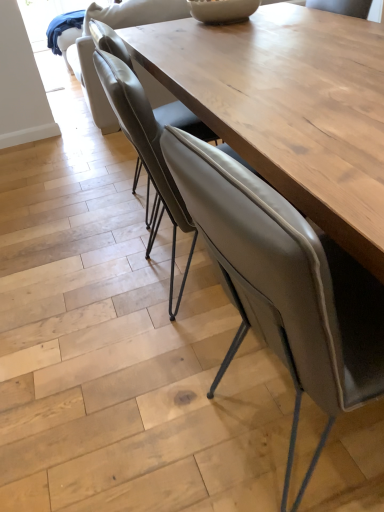
Question: Is matte gray chair at center, the 1th chair when ordered from front to back, taller or shorter than matte gray chair at center, positioned as the second chair in back-to-front order?

Choices:
 (A) short
 (B) tall

Answer: (B)

Question: Considering the positions of matte gray chair at center, the 1th chair when ordered from front to back, and matte gray chair at center, the 2th chair from the front, in the image, is matte gray chair at center, the 1th chair when ordered from front to back, wider or thinner than matte gray chair at center, the 2th chair from the front,?

Choices:
 (A) wide
 (B) thin

Answer: (A)

Question: Considering the real-world distances, which object is farthest from the leather armchair at upper center?

Choices:
 (A) matte gray chair at center, the 1th chair when ordered from front to back
 (B) leather-like beige chair at center, arranged as the third chair when viewed from the front
 (C) matte gray chair at center, positioned as the second chair in back-to-front order

Answer: (A)

Question: Which is nearer to the matte gray chair at center, the 2th chair from the front?

Choices:
 (A) leather armchair at upper center
 (B) leather-like beige chair at center, the first chair in the back-to-front sequence
 (C) matte gray chair at center, which appears as the 3th chair when viewed from the back

Answer: (B)